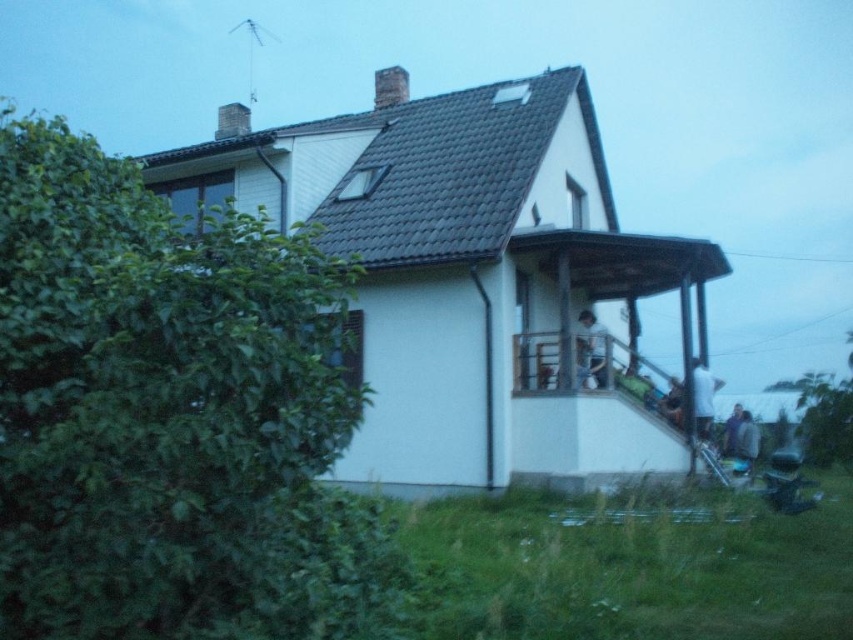
You are a photographer standing in front of the house and want to take a photo that includes both the white fabric shirt at upper center and the light brown leather jacket at lower right. Which of these two items will appear closer to the camera in the final photo?

The white fabric shirt at upper center will appear closer to the camera because it is positioned in front of the light brown leather jacket at lower right.

You are standing in front of the house and see two people wearing different clothing items. The first person is wearing a white fabric shirt at upper center, and the second is wearing a light brown leather jacket at lower right. Which clothing item is positioned more to the left side of the image?

The white fabric shirt at upper center is positioned to the left of the light brown leather jacket at lower right, so the white fabric shirt at upper center is more to the left.